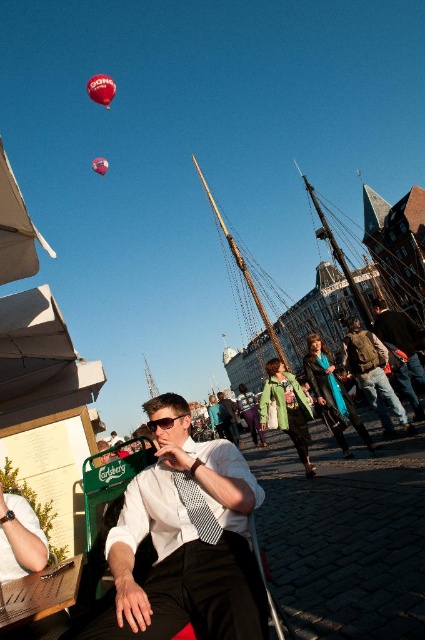
In the scene described, there is a wooden ship at center and a shiny red balloon at upper left. Which object is larger in size?

The wooden ship at center is smaller than the shiny red balloon at upper left.

You are a photographer trying to capture the man in the scene. You notice the leather jacket at center and the matte white shirt at center. Which item should you focus on to ensure the man is fully visible in your photo?

The leather jacket at center is above the matte white shirt at center, so focusing on the leather jacket at center would ensure the man is fully visible in the photo.

Based on the scene description, where is the white glossy shirt at center located in terms of coordinates?

The white glossy shirt at center is located at coordinates point (186, 541).